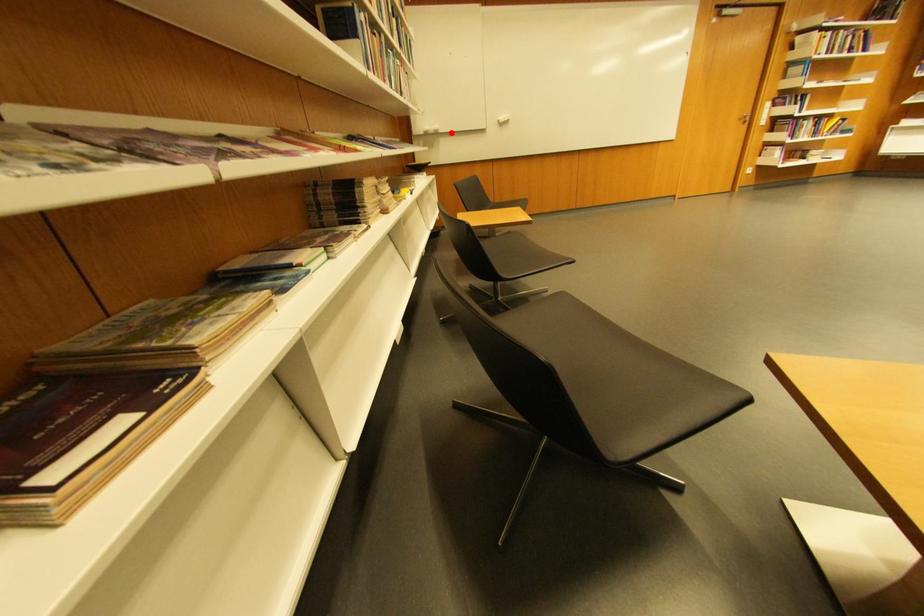
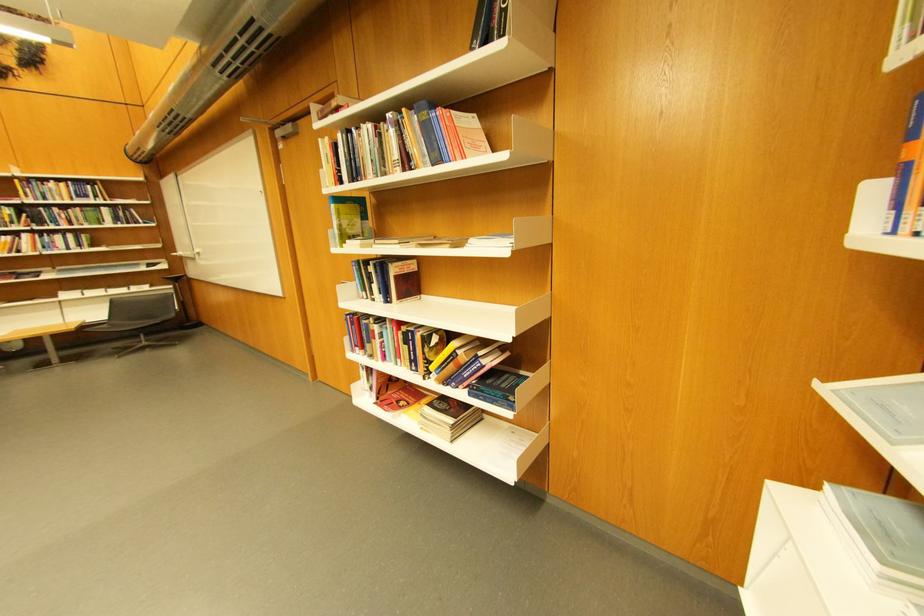
Question: I am providing you with two images of the same scene from different viewpoints. A red point is shown in image1. For the corresponding object point in image2, is it positioned nearer or farther from the camera?

Choices:
 (A) Nearer
 (B) Farther

Answer: (B)